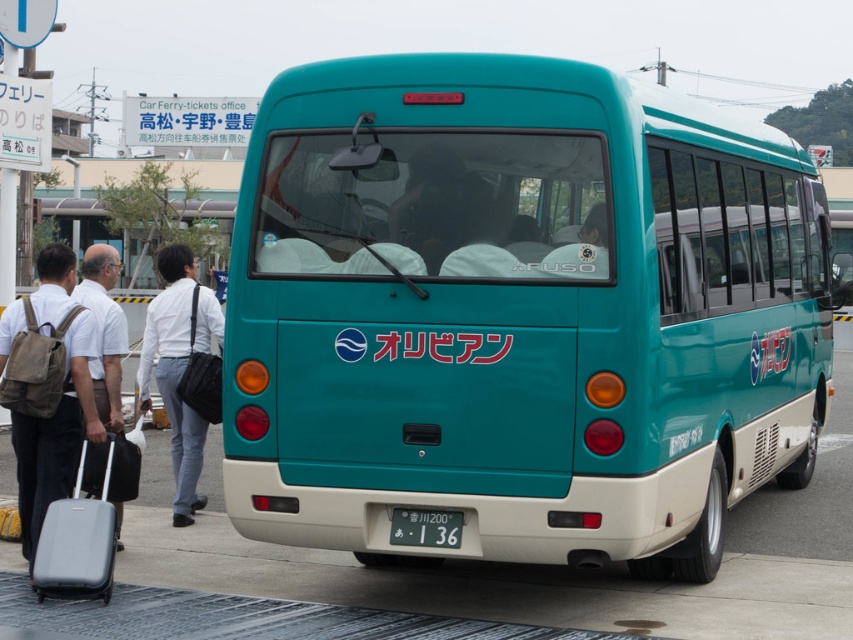
Does brown canvas backpack at left appear under white smooth shirt at left?

Yes, brown canvas backpack at left is below white smooth shirt at left.

Consider the image. Does brown canvas backpack at left have a lesser width compared to white smooth shirt at left?

Incorrect, brown canvas backpack at left's width is not less than white smooth shirt at left's.

Is point (70, 308) positioned in front of point (186, 426)?

That is True.

Locate an element on the screen. This screenshot has height=640, width=853. brown canvas backpack at left is located at coordinates (57, 404).

Which is more to the right, matte gray suitcase at lower left or white plastic license plate at center?

white plastic license plate at center is more to the right.

The width and height of the screenshot is (853, 640). What do you see at coordinates (77, 541) in the screenshot?
I see `matte gray suitcase at lower left` at bounding box center [77, 541].

At what (x,y) coordinates should I click in order to perform the action: click on matte gray suitcase at lower left. Please return your answer as a coordinate pair (x, y). This screenshot has height=640, width=853. Looking at the image, I should click on (77, 541).

Locate an element on the screen. matte gray suitcase at lower left is located at coordinates [x=77, y=541].

Is brown canvas backpack at left shorter than white plastic license plate at center?

In fact, brown canvas backpack at left may be taller than white plastic license plate at center.

Is brown canvas backpack at left above white plastic license plate at center?

Yes.

Does point (82, 376) come behind point (448, 524)?

Yes, it is.

At what (x,y) coordinates should I click in order to perform the action: click on brown canvas backpack at left. Please return your answer as a coordinate pair (x, y). The width and height of the screenshot is (853, 640). Looking at the image, I should click on (57, 404).